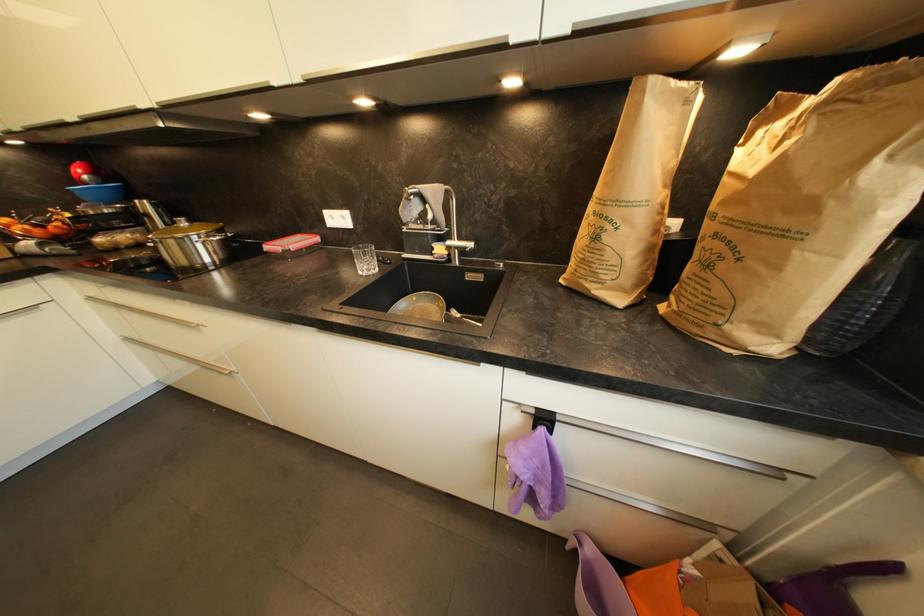
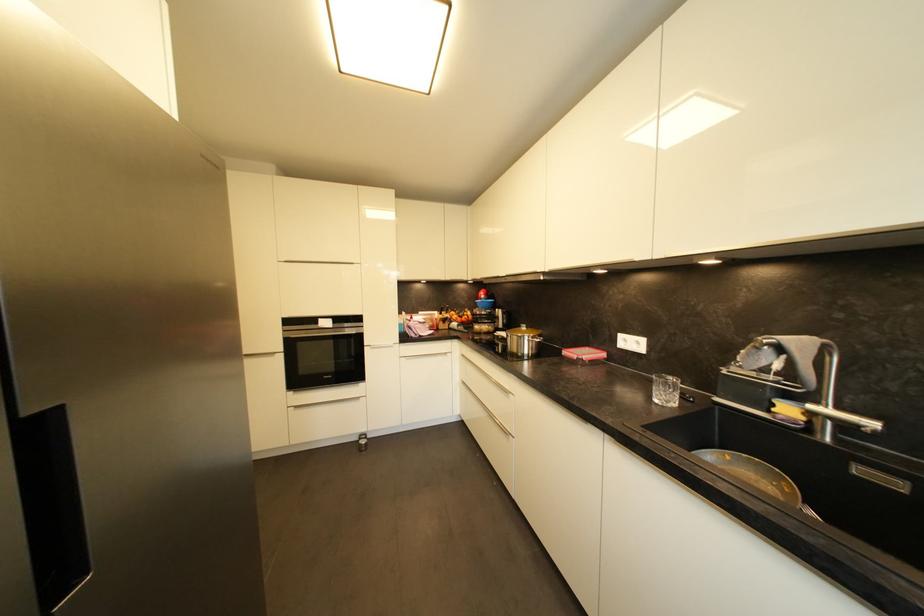
In the second image, find the point that corresponds to [444,310] in the first image.

(787, 493)